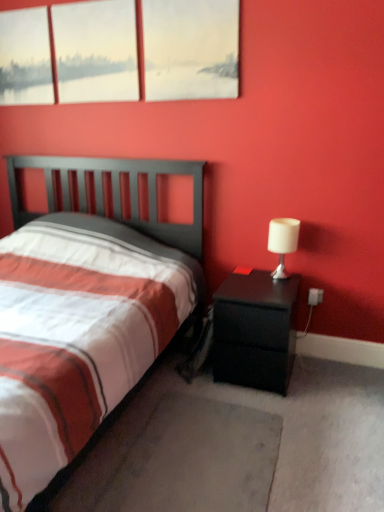
Question: Does matte white painting at upper center, which is counted as the third window, starting from the left, have a lesser width compared to gray carpet at lower center?

Choices:
 (A) no
 (B) yes

Answer: (B)

Question: From the image's perspective, would you say matte white painting at upper center, arranged as the first window when viewed from the right, is positioned over gray carpet at lower center?

Choices:
 (A) no
 (B) yes

Answer: (B)

Question: Is matte white painting at upper center, arranged as the first window when viewed from the right, closer to camera compared to gray carpet at lower center?

Choices:
 (A) no
 (B) yes

Answer: (A)

Question: Is gray carpet at lower center a part of matte white painting at upper center, which is counted as the third window, starting from the left?

Choices:
 (A) yes
 (B) no

Answer: (B)

Question: Considering the relative sizes of matte white painting at upper center, which is counted as the third window, starting from the left, and gray carpet at lower center in the image provided, is matte white painting at upper center, which is counted as the third window, starting from the left, taller than gray carpet at lower center?

Choices:
 (A) yes
 (B) no

Answer: (A)

Question: Relative to matte glass window at upper left, arranged as the second window when viewed from the right, is black matte nightstand at right in front or behind?

Choices:
 (A) behind
 (B) front

Answer: (B)

Question: Is point (251, 322) closer or farther from the camera than point (74, 6)?

Choices:
 (A) closer
 (B) farther

Answer: (A)

Question: Do you think black matte nightstand at right is within matte glass window at upper left, arranged as the second window when viewed from the right, or outside of it?

Choices:
 (A) outside
 (B) inside

Answer: (A)

Question: Considering the positions of black matte nightstand at right and matte glass window at upper left, arranged as the second window when viewed from the right, in the image, is black matte nightstand at right bigger or smaller than matte glass window at upper left, arranged as the second window when viewed from the right,?

Choices:
 (A) small
 (B) big

Answer: (B)

Question: Would you say matte white painting at upper center, arranged as the first window when viewed from the right, is inside or outside matte white canvas at upper left, the third window viewed from the right?

Choices:
 (A) outside
 (B) inside

Answer: (A)

Question: Is matte white painting at upper center, arranged as the first window when viewed from the right, in front of or behind matte white canvas at upper left, the 1th window viewed from the left, in the image?

Choices:
 (A) behind
 (B) front

Answer: (B)

Question: Considering the positions of matte white painting at upper center, arranged as the first window when viewed from the right, and matte white canvas at upper left, the third window viewed from the right, in the image, is matte white painting at upper center, arranged as the first window when viewed from the right, bigger or smaller than matte white canvas at upper left, the third window viewed from the right,?

Choices:
 (A) big
 (B) small

Answer: (A)

Question: Is point (145, 30) closer or farther from the camera than point (24, 98)?

Choices:
 (A) closer
 (B) farther

Answer: (A)

Question: Relative to gray carpet at lower center, is matte white canvas at upper left, the third window viewed from the right, in front or behind?

Choices:
 (A) behind
 (B) front

Answer: (A)

Question: Considering the positions of matte white canvas at upper left, the third window viewed from the right, and gray carpet at lower center in the image, is matte white canvas at upper left, the third window viewed from the right, wider or thinner than gray carpet at lower center?

Choices:
 (A) thin
 (B) wide

Answer: (A)